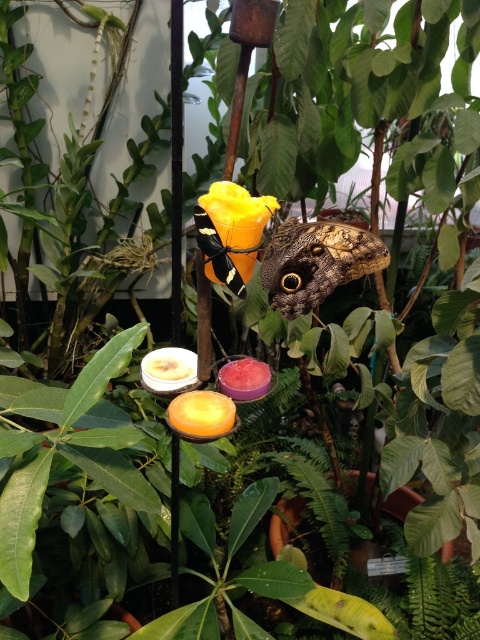
Between point (322, 257) and point (228, 248), which one is positioned in front?

Point (322, 257)

Can you confirm if camouflage-patterned moth at center is smaller than yellow matte flower at center?

No.

You are a GUI agent. You are given a task and a screenshot of the screen. Output one action in this format:
    pyautogui.click(x=<x>, y=<y>)
    Task: Click on the camouflage-patterned moth at center
    
    Given the screenshot: What is the action you would take?
    pyautogui.click(x=315, y=262)